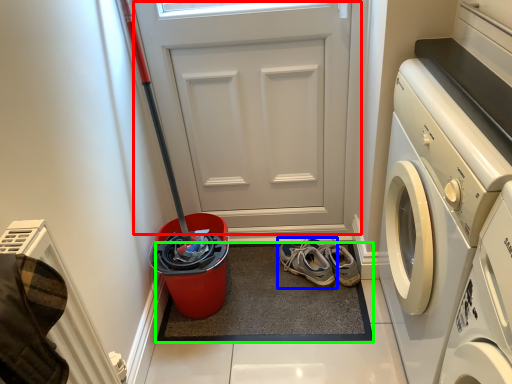
Question: Which object is the farthest from door (highlighted by a red box)? Choose among these: footwear (highlighted by a blue box) or doormat (highlighted by a green box).

Choices:
 (A) footwear
 (B) doormat

Answer: (B)